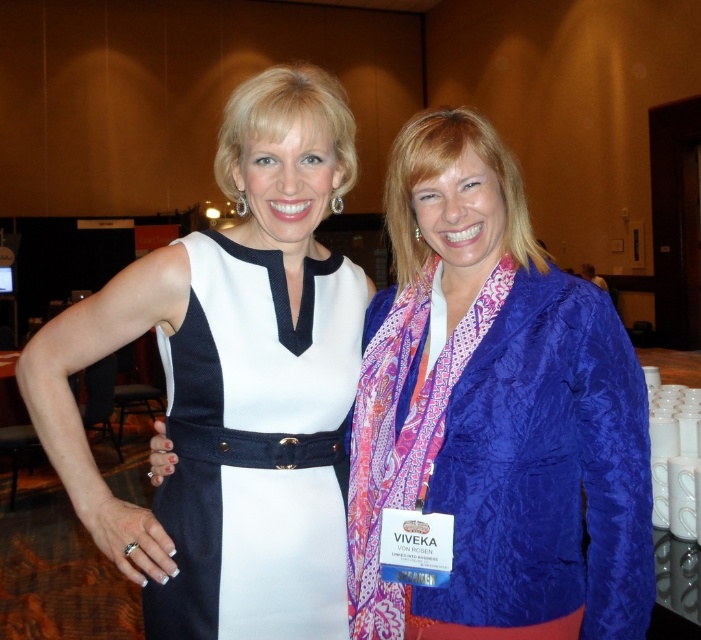
Based on the photo, you are a fashion designer observing the two outfits in the scene. Which outfit is taller between the blue silk blazer at center and the white textured fabric dress at left?

The blue silk blazer at center is much taller than the white textured fabric dress at left.

You are a photographer who needs to adjust the lighting to highlight the blue silk blazer at center. Based on the coordinates provided, where should you position the light source relative to the blazer?

The blue silk blazer at center is positioned at coordinates point (494, 413). To effectively highlight it, place the light source directly in front of the blazer at those coordinates to ensure even illumination.

You are a photographer setting up for a group photo. You need to ensure that the blue silk blazer at center and the white textured fabric dress at left are both visible in the frame. Based on their positions, which one should you focus on first to ensure both are in the shot?

The blue silk blazer at center is located above the white textured fabric dress at left, so you should focus on the white textured fabric dress at left first to ensure both are in the frame.